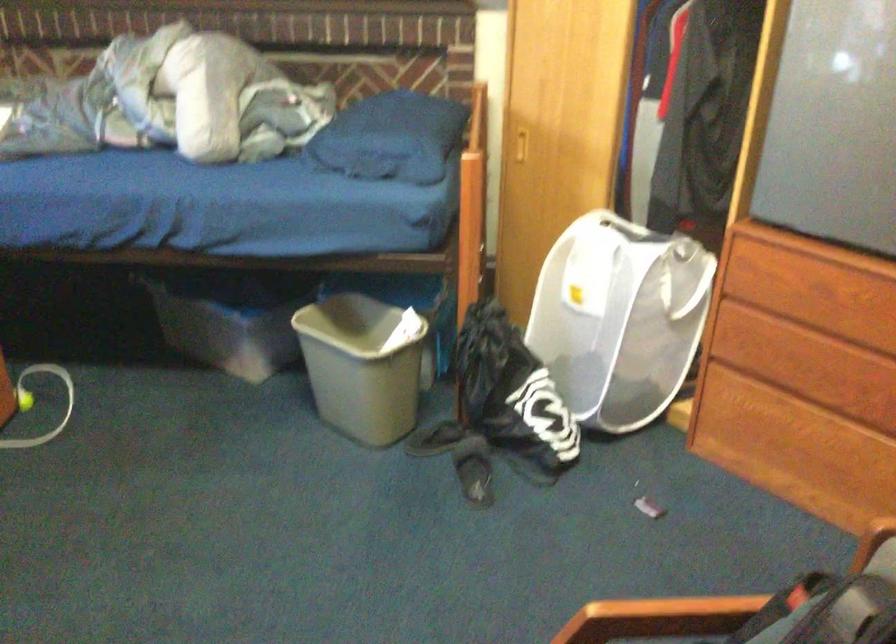
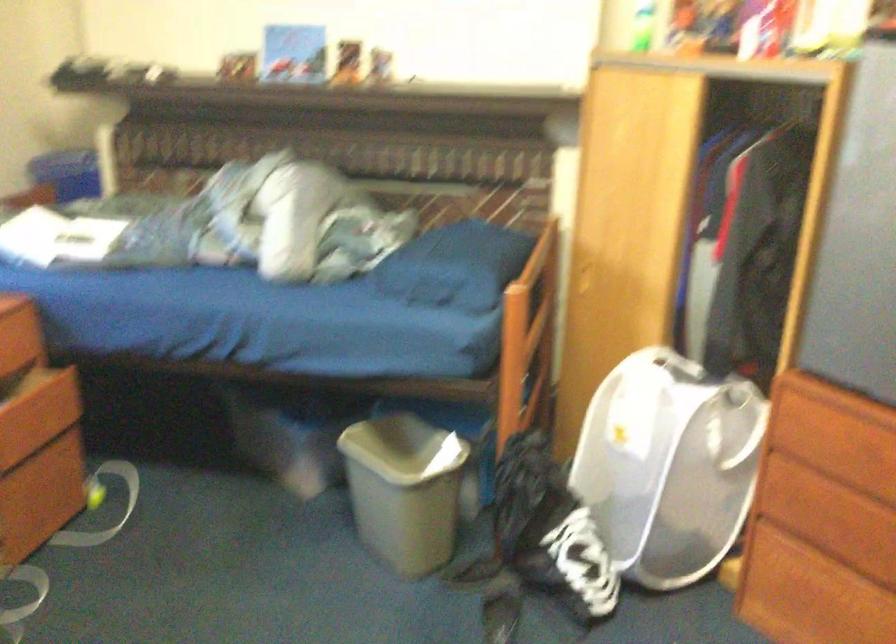
The point at (368,368) is marked in the first image. Where is the corresponding point in the second image?

(403, 489)